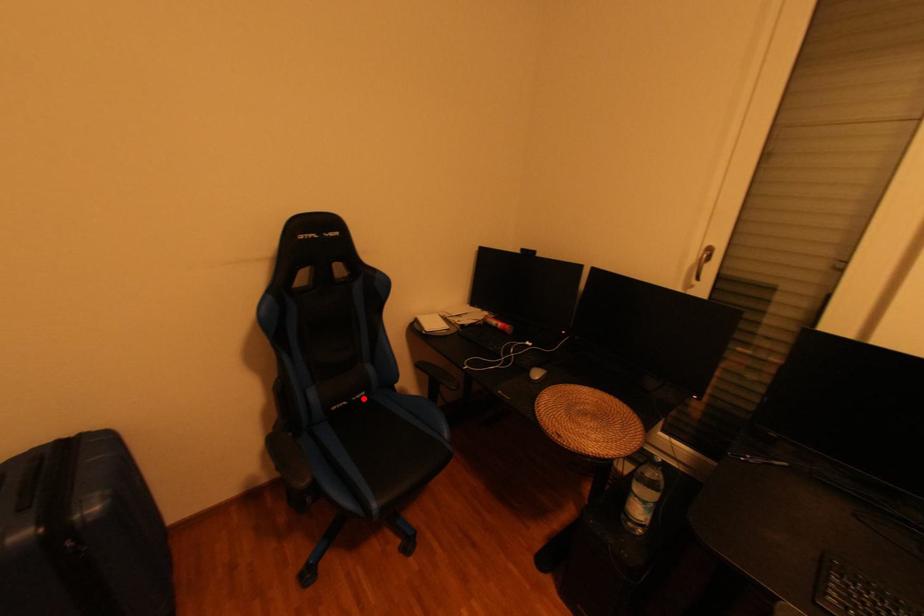
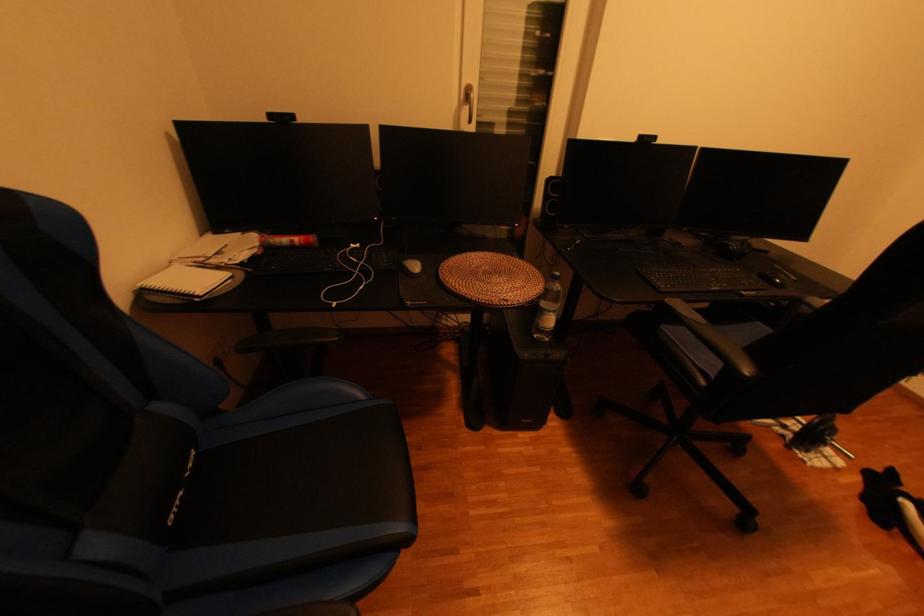
Question: I am providing you with two images of the same scene from different viewpoints. Image1 has a red point marked. In image2, the corresponding 3D location appears at what relative position? Reply with the corresponding letter.

Choices:
 (A) Closer
 (B) Farther

Answer: (B)